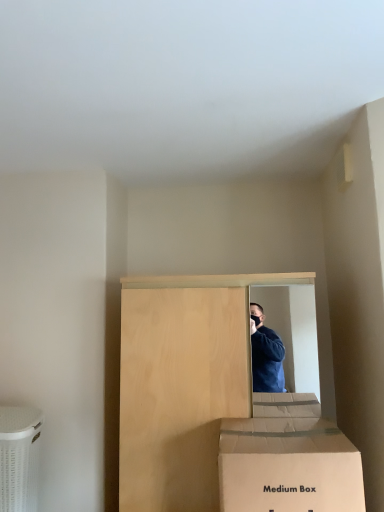
Question: Is bare wood cabinet at center not within white cardboard box at lower center?

Choices:
 (A) yes
 (B) no

Answer: (A)

Question: Can you confirm if bare wood cabinet at center is thinner than white cardboard box at lower center?

Choices:
 (A) yes
 (B) no

Answer: (B)

Question: Are bare wood cabinet at center and white cardboard box at lower center making contact?

Choices:
 (A) yes
 (B) no

Answer: (B)

Question: Is the position of bare wood cabinet at center more distant than that of white cardboard box at lower center?

Choices:
 (A) no
 (B) yes

Answer: (B)

Question: Can you confirm if bare wood cabinet at center is smaller than white cardboard box at lower center?

Choices:
 (A) no
 (B) yes

Answer: (A)

Question: Is cardboard box at lower left inside the boundaries of white cardboard box at lower center, or outside?

Choices:
 (A) outside
 (B) inside

Answer: (A)

Question: Does point (13, 479) appear closer or farther from the camera than point (326, 468)?

Choices:
 (A) farther
 (B) closer

Answer: (A)

Question: From the image's perspective, relative to white cardboard box at lower center, is cardboard box at lower left above or below?

Choices:
 (A) above
 (B) below

Answer: (B)

Question: In the image, is cardboard box at lower left on the left side or the right side of white cardboard box at lower center?

Choices:
 (A) left
 (B) right

Answer: (A)

Question: Based on their sizes in the image, would you say white cardboard box at lower center is bigger or smaller than cardboard box at lower left?

Choices:
 (A) big
 (B) small

Answer: (A)

Question: Considering the positions of point (344, 497) and point (29, 483), is point (344, 497) closer or farther from the camera than point (29, 483)?

Choices:
 (A) farther
 (B) closer

Answer: (B)

Question: From a real-world perspective, is white cardboard box at lower center physically located above or below cardboard box at lower left?

Choices:
 (A) above
 (B) below

Answer: (A)

Question: Looking at their shapes, would you say white cardboard box at lower center is wider or thinner than cardboard box at lower left?

Choices:
 (A) wide
 (B) thin

Answer: (A)

Question: From a real-world perspective, is bare wood cabinet at center physically located above or below cardboard box at lower left?

Choices:
 (A) below
 (B) above

Answer: (B)

Question: Is bare wood cabinet at center wider or thinner than cardboard box at lower left?

Choices:
 (A) thin
 (B) wide

Answer: (B)